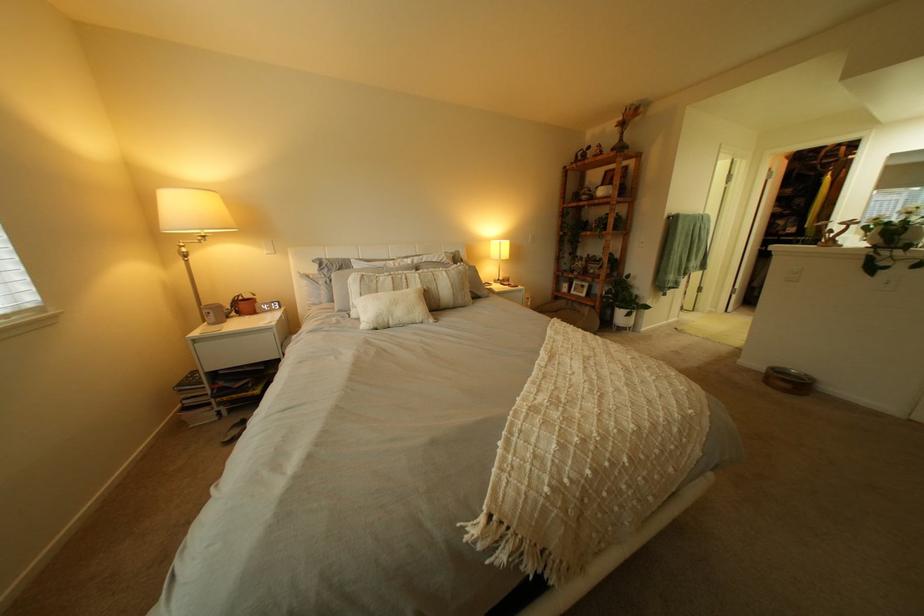
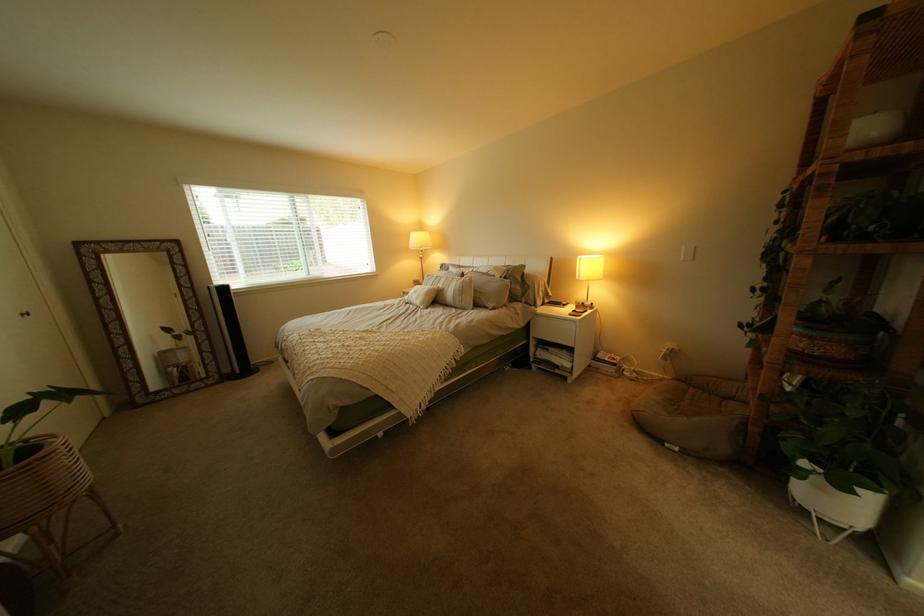
Find the pixel in the second image that matches (476,269) in the first image.

(482, 280)